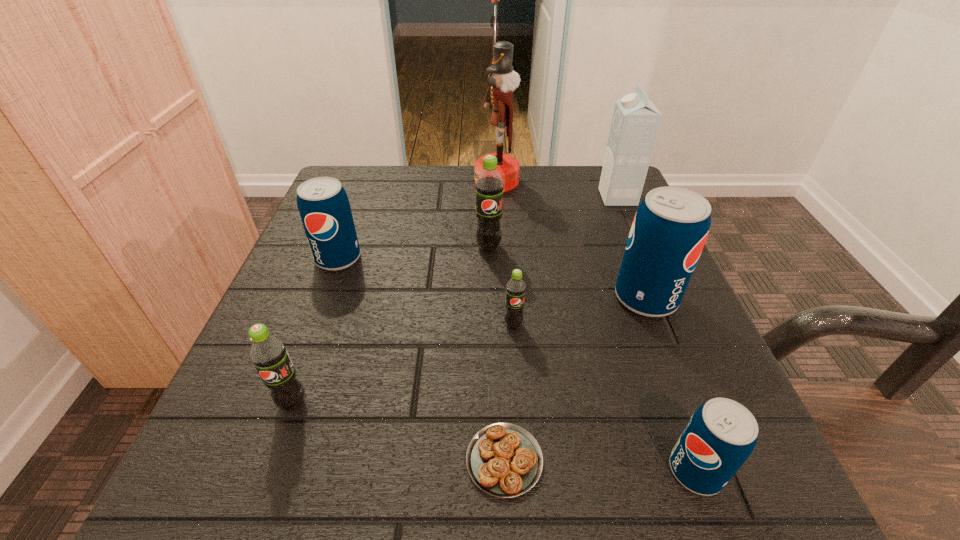
Image resolution: width=960 pixels, height=540 pixels. Find the location of `nutcracker`. nutcracker is located at coordinates (503, 79).

Identify the location of red nutcracker. (503, 79).

Find the location of a particular element. The width and height of the screenshot is (960, 540). carton is located at coordinates (635, 123).

This screenshot has height=540, width=960. Identify the location of the second nearest blue pop. (670, 228).

Find the location of `the farthest green soda`. the farthest green soda is located at coordinates (489, 185).

Where is `the second biggest blue pop`? the second biggest blue pop is located at coordinates (324, 208).

Where is `the farthest blue pop`? the farthest blue pop is located at coordinates (324, 208).

Where is `the third nearest object`? This screenshot has width=960, height=540. the third nearest object is located at coordinates (268, 353).

Image resolution: width=960 pixels, height=540 pixels. Find the location of `the nearest green soda`. the nearest green soda is located at coordinates (268, 353).

Where is `the smallest green soda`? the smallest green soda is located at coordinates (516, 288).